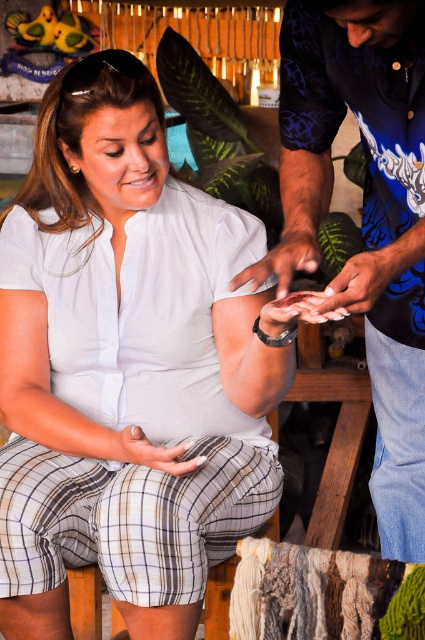
Is the position of white matte shirt at center less distant than that of blue printed shirt at center?

No, white matte shirt at center is further to the viewer.

Can you confirm if white matte shirt at center is taller than blue printed shirt at center?

Correct, white matte shirt at center is much taller as blue printed shirt at center.

Does point (167, 621) come in front of point (363, 288)?

No.

Image resolution: width=425 pixels, height=640 pixels. Identify the location of white matte shirt at center. (127, 364).